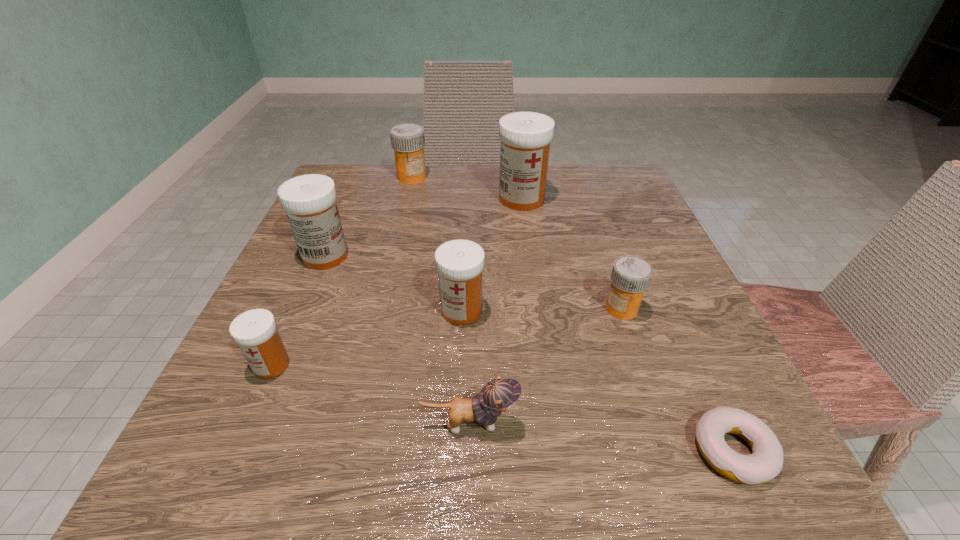
Where is `the smallest white medicine`? The width and height of the screenshot is (960, 540). the smallest white medicine is located at coordinates (255, 331).

What are the coordinates of `the nearest medicine` in the screenshot? It's located at (255, 331).

At what (x,y) coordinates should I click in order to perform the action: click on kitten. Please return your answer as a coordinate pair (x, y). This screenshot has width=960, height=540. Looking at the image, I should click on [x=498, y=395].

Where is `doughnut`? This screenshot has height=540, width=960. doughnut is located at coordinates tap(766, 461).

Locate an element on the screen. Image resolution: width=960 pixels, height=540 pixels. brown doughnut is located at coordinates (766, 461).

Identify the location of vacant space located 0.330m on the front of the tallest medicine. This screenshot has height=540, width=960. (539, 323).

Where is `blank area located on the front of the second tallest object`? blank area located on the front of the second tallest object is located at coordinates click(x=268, y=392).

Locate an element on the screen. Image resolution: width=960 pixels, height=540 pixels. vacant area situated 0.260m on the label side of the farthest object is located at coordinates (394, 252).

Find the location of a particular element. vacant space located 0.060m on the left of the second nearest white medicine is located at coordinates (403, 310).

Where is `vacant position located 0.100m on the label side of the smaller orange medicine`? Image resolution: width=960 pixels, height=540 pixels. vacant position located 0.100m on the label side of the smaller orange medicine is located at coordinates (544, 308).